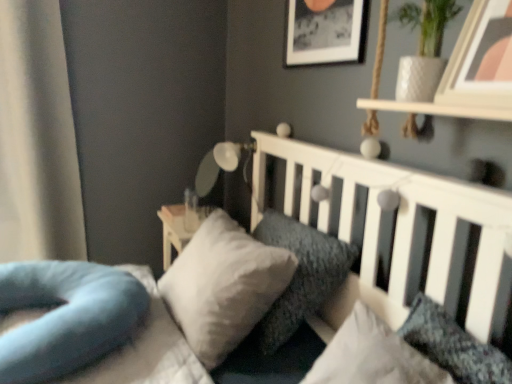
Question: Is point (298, 18) positioned closer to the camera than point (352, 276)?

Choices:
 (A) closer
 (B) farther

Answer: (B)

Question: Is black matte picture frame at upper center, positioned as the second picture frame in right-to-left order, situated inside white soft bed at center or outside?

Choices:
 (A) inside
 (B) outside

Answer: (B)

Question: Which of these objects is positioned closest to the textured gray pillow at center, positioned as the 1th pillow in right-to-left order?

Choices:
 (A) wooden picture frame at upper right, which appears as the second picture frame when viewed from the back
 (B) white glossy lamp at upper center
 (C) soft gray pillow at center, arranged as the 3th pillow when viewed from the left
 (D) black matte picture frame at upper center, which is counted as the second picture frame, starting from the front
 (E) white soft pillow at center, which appears as the third pillow when viewed from the right

Answer: (C)

Question: Which object is the farthest from the white glossy lamp at upper center?

Choices:
 (A) black matte picture frame at upper center, which is counted as the second picture frame, starting from the front
 (B) white soft bed at center
 (C) textured gray pillow at center, the 4th pillow from the left
 (D) white soft pillow at center, which appears as the third pillow when viewed from the right
 (E) soft blue pillow at lower left, which appears as the first pillow when viewed from the left

Answer: (C)